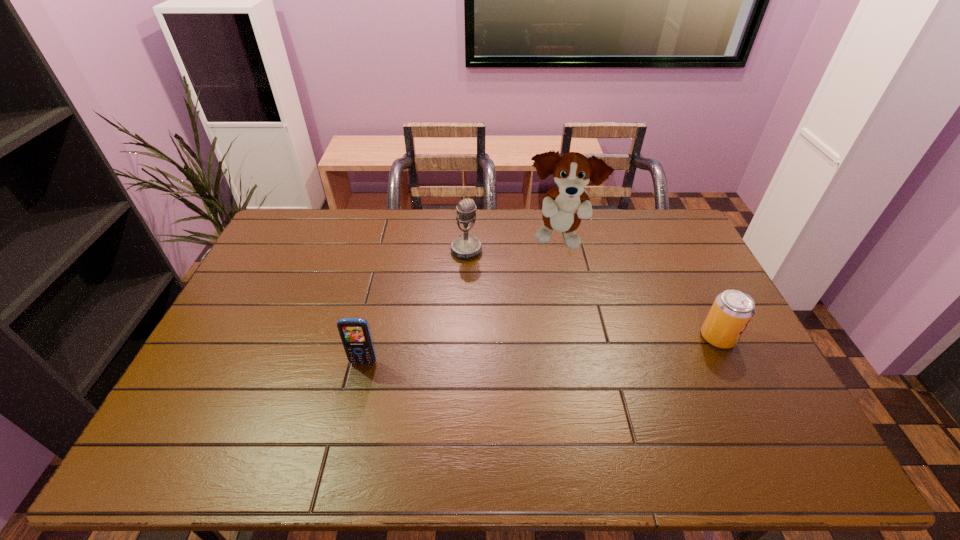
Image resolution: width=960 pixels, height=540 pixels. I want to click on vacant space at the near edge, so click(x=473, y=407).

Where is `vacant area at the right edge of the desktop`? The width and height of the screenshot is (960, 540). vacant area at the right edge of the desktop is located at coordinates (675, 278).

I want to click on free space between the puppy and the microphone, so click(x=513, y=245).

Image resolution: width=960 pixels, height=540 pixels. I want to click on vacant area that lies between the third object from right to left and the shortest object, so click(592, 294).

Locate an element on the screen. blank region between the nearest object and the tallest object is located at coordinates (462, 301).

Identify the location of vacant area between the leftmost object and the rightmost object. The width and height of the screenshot is (960, 540). (540, 350).

Locate an element on the screen. This screenshot has height=540, width=960. empty location between the cellular telephone and the shortest object is located at coordinates (540, 350).

Locate an element on the screen. vacant region between the third object from right to left and the third object from left to right is located at coordinates (513, 245).

You are a GUI agent. You are given a task and a screenshot of the screen. Output one action in this format:
    pyautogui.click(x=<x>, y=<y>)
    Task: Click on the vacant space in between the third shortest object and the puppy
    
    Given the screenshot: What is the action you would take?
    pyautogui.click(x=513, y=245)

Find the location of a particular element. This screenshot has height=540, width=960. vacant area that lies between the third shortest object and the puppy is located at coordinates (513, 245).